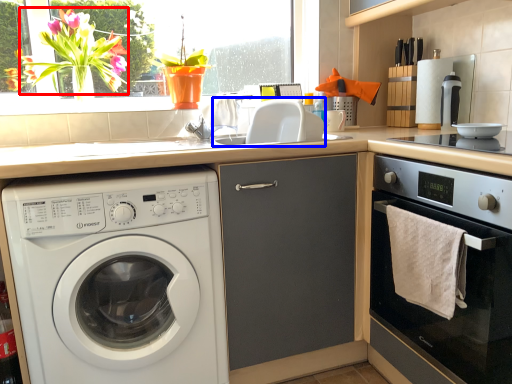
Question: Which object is closer to the camera taking this photo, flower (highlighted by a red box) or sink (highlighted by a blue box)?

Choices:
 (A) flower
 (B) sink

Answer: (B)